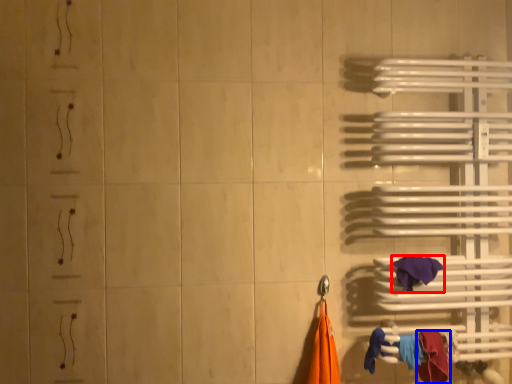
Question: Among these objects, which one is farthest to the camera, towel (highlighted by a red box) or towel (highlighted by a blue box)?

Choices:
 (A) towel
 (B) towel

Answer: (A)